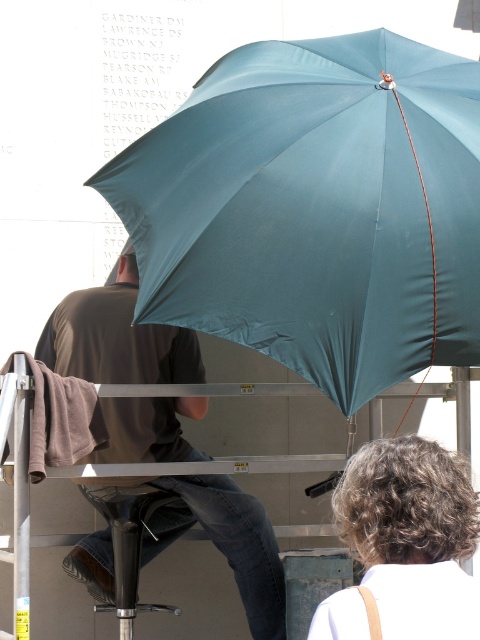
Question: Which point is closer to the camera?

Choices:
 (A) black plastic stool at lower center
 (B) matte black shirt at center

Answer: (B)

Question: Can you confirm if matte black shirt at center is positioned to the right of black plastic stool at lower center?

Choices:
 (A) no
 (B) yes

Answer: (B)

Question: Is curly hair at upper right closer to the viewer compared to black plastic stool at lower center?

Choices:
 (A) no
 (B) yes

Answer: (B)

Question: Among these points, which one is farthest from the camera?

Choices:
 (A) (336, 609)
 (B) (88, 490)
 (C) (255, 625)
 (D) (369, 275)

Answer: (B)

Question: Is teal fabric umbrella at upper center to the left of black plastic stool at lower center from the viewer's perspective?

Choices:
 (A) yes
 (B) no

Answer: (B)

Question: Which point is closer to the camera taking this photo?

Choices:
 (A) (346, 481)
 (B) (172, 499)

Answer: (A)